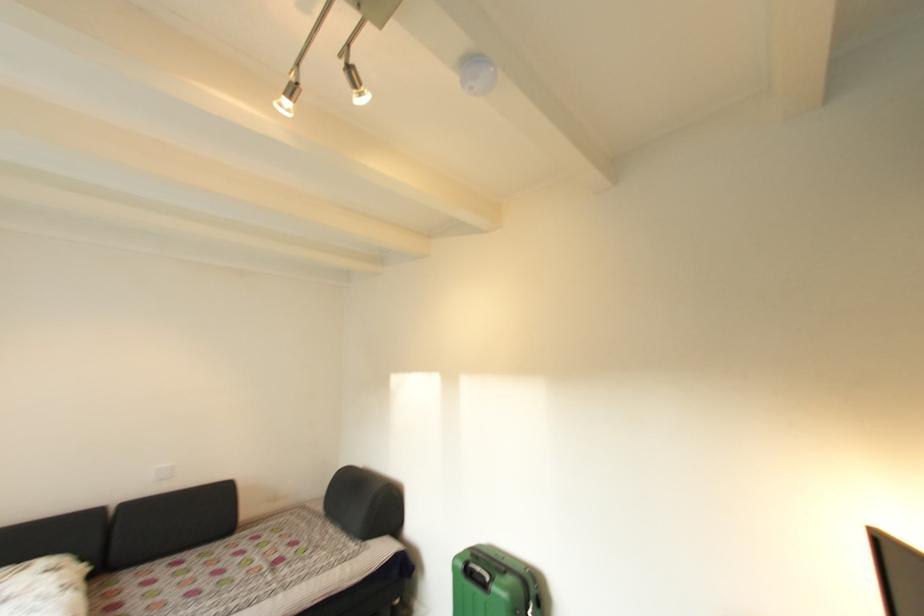
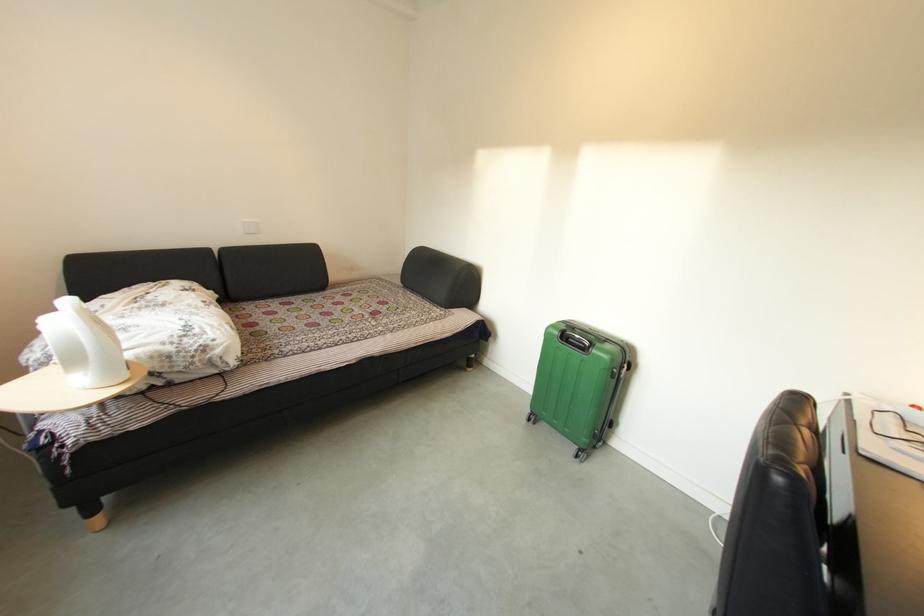
Where in the second image is the point corresponding to [261,533] from the first image?

(349, 293)